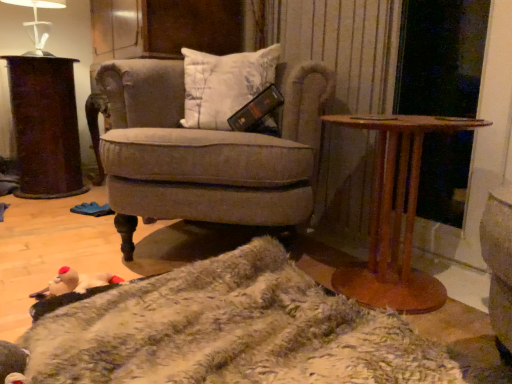
The height and width of the screenshot is (384, 512). Describe the element at coordinates (395, 215) in the screenshot. I see `brown wood table at right` at that location.

Describe the element at coordinates (204, 153) in the screenshot. I see `velvet beige armchair at center` at that location.

What is the approximate height of white cotton pillow at center?

The height of white cotton pillow at center is 17.66 inches.

Locate an element on the screen. white cotton pillow at center is located at coordinates (224, 84).

In order to click on brown wood table at right in this screenshot , I will do `click(395, 215)`.

Considering the relative positions of white glossy table lamp at upper left and velvet beige armchair at center in the image provided, is white glossy table lamp at upper left to the left or to the right of velvet beige armchair at center?

From the image, it's evident that white glossy table lamp at upper left is to the left of velvet beige armchair at center.

Which is behind, white glossy table lamp at upper left or velvet beige armchair at center?

white glossy table lamp at upper left is behind.

From a real-world perspective, is white glossy table lamp at upper left located higher than velvet beige armchair at center?

Yes, from a real-world perspective, white glossy table lamp at upper left is over velvet beige armchair at center

Considering the sizes of objects white glossy table lamp at upper left and velvet beige armchair at center in the image provided, who is smaller, white glossy table lamp at upper left or velvet beige armchair at center?

Smaller between the two is white glossy table lamp at upper left.

In the scene shown: Could you tell me if brown wood table at right is facing dark brown polished wood desk at left?

No, brown wood table at right is not facing towards dark brown polished wood desk at left.

Based on the photo, from the image's perspective, is brown wood table at right beneath dark brown polished wood desk at left?

Yes.

From a real-world perspective, is brown wood table at right physically located above or below dark brown polished wood desk at left?

brown wood table at right is below dark brown polished wood desk at left.

In the image, there is a brown wood table at right. Where is `desk above it (from the image's perspective)`? Image resolution: width=512 pixels, height=384 pixels. desk above it (from the image's perspective) is located at coordinates (45, 126).

Can you confirm if brown wood table at right is shorter than white cotton pillow at center?

Incorrect, the height of brown wood table at right does not fall short of that of white cotton pillow at center.

Between brown wood table at right and white cotton pillow at center, which one has larger width?

brown wood table at right is wider.

Is brown wood table at right in contact with white cotton pillow at center?

No, brown wood table at right is not touching white cotton pillow at center.

Considering their positions, is brown wood table at right located in front of or behind white cotton pillow at center?

brown wood table at right is in front of white cotton pillow at center.

Which object is wider, velvet beige armchair at center or white glossy table lamp at upper left?

Wider between the two is velvet beige armchair at center.

Between point (270, 191) and point (34, 41), which one is positioned in front?

The point (270, 191) is in front.

Based on the photo, in the image, is velvet beige armchair at center on the left side or the right side of white glossy table lamp at upper left?

In the image, velvet beige armchair at center appears on the right side of white glossy table lamp at upper left.

Does velvet beige armchair at center lie in front of white glossy table lamp at upper left?

→ Yes, it is.

Which object is more forward, white cotton pillow at center or brown wood table at right?

Positioned in front is brown wood table at right.

Find the location of `table in front of the white cotton pillow at center`. table in front of the white cotton pillow at center is located at coordinates (395, 215).

Looking at this image, would you say brown wood table at right is part of white cotton pillow at center's contents?

No.

In the scene shown: Is white cotton pillow at center positioned far away from brown wood table at right?

No, white cotton pillow at center is in close proximity to brown wood table at right.

Can you tell me how much dark brown polished wood desk at left and white glossy table lamp at upper left differ in facing direction?

0.675 degrees.

Considering the relative sizes of dark brown polished wood desk at left and white glossy table lamp at upper left in the image provided, is dark brown polished wood desk at left wider than white glossy table lamp at upper left?

Indeed, dark brown polished wood desk at left has a greater width compared to white glossy table lamp at upper left.

Is point (49, 90) closer to camera compared to point (39, 24)?

That is True.

Is white glossy table lamp at upper left located within dark brown polished wood desk at left?

Actually, white glossy table lamp at upper left is outside dark brown polished wood desk at left.

Find the location of `desk on the left of white cotton pillow at center`. desk on the left of white cotton pillow at center is located at coordinates (45, 126).

Based on their sizes in the image, would you say white cotton pillow at center is bigger or smaller than dark brown polished wood desk at left?

In the image, white cotton pillow at center appears to be smaller than dark brown polished wood desk at left.

From the image's perspective, is white cotton pillow at center located beneath dark brown polished wood desk at left?

No, from the image's perspective, white cotton pillow at center is not beneath dark brown polished wood desk at left.

Considering their positions, is white cotton pillow at center located in front of or behind dark brown polished wood desk at left?

white cotton pillow at center is in front of dark brown polished wood desk at left.

This screenshot has width=512, height=384. Identify the location of table lamp to the left of velvet beige armchair at center. (38, 24).

The height and width of the screenshot is (384, 512). What are the coordinates of `table in front of the dark brown polished wood desk at left` in the screenshot? It's located at (395, 215).

Based on their spatial positions, is fuzzy beige blanket at lower center or white glossy table lamp at upper left closer to brown wood table at right?

The object closer to brown wood table at right is fuzzy beige blanket at lower center.

In the scene shown: Looking at the image, which one is located further to white glossy table lamp at upper left, brown wood table at right or white cotton pillow at center?

Based on the image, brown wood table at right appears to be further to white glossy table lamp at upper left.

When comparing their distances from dark brown polished wood desk at left, does fuzzy beige blanket at lower center or white glossy table lamp at upper left seem closer?

white glossy table lamp at upper left is closer to dark brown polished wood desk at left.

Based on their spatial positions, is white cotton pillow at center or velvet beige armchair at center closer to brown wood table at right?

The object closer to brown wood table at right is velvet beige armchair at center.

From the image, which object appears to be nearer to white cotton pillow at center, velvet beige armchair at center or brown wood table at right?

Based on the image, velvet beige armchair at center appears to be nearer to white cotton pillow at center.

Looking at this image, which object lies further to the anchor point white glossy table lamp at upper left, fuzzy beige blanket at lower center or velvet beige armchair at center?

fuzzy beige blanket at lower center is further to white glossy table lamp at upper left.

Considering their positions, is brown wood table at right positioned further to dark brown polished wood desk at left than white glossy table lamp at upper left?

Based on the image, brown wood table at right appears to be further to dark brown polished wood desk at left.

Considering their positions, is brown wood table at right positioned further to white cotton pillow at center than velvet beige armchair at center?

Based on the image, brown wood table at right appears to be further to white cotton pillow at center.

Where is `table lamp between dark brown polished wood desk at left and white cotton pillow at center`? The width and height of the screenshot is (512, 384). table lamp between dark brown polished wood desk at left and white cotton pillow at center is located at coordinates (38, 24).

Locate an element on the screen. The height and width of the screenshot is (384, 512). table lamp between dark brown polished wood desk at left and velvet beige armchair at center from left to right is located at coordinates (38, 24).

Identify the location of chair positioned between fuzzy beige blanket at lower center and white cotton pillow at center from near to far. (204, 153).

Where is `chair between dark brown polished wood desk at left and brown wood table at right`? The image size is (512, 384). chair between dark brown polished wood desk at left and brown wood table at right is located at coordinates (204, 153).